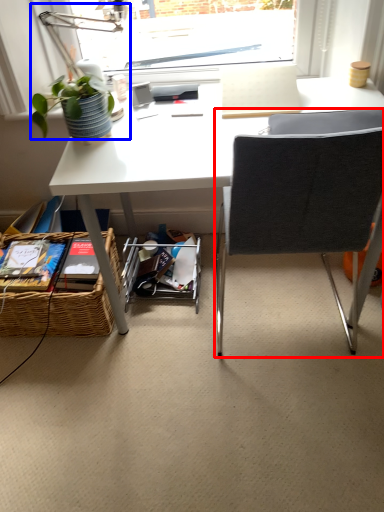
Question: Which object appears farthest to the camera in this image, chair (highlighted by a red box) or table lamp (highlighted by a blue box)?

Choices:
 (A) chair
 (B) table lamp

Answer: (B)